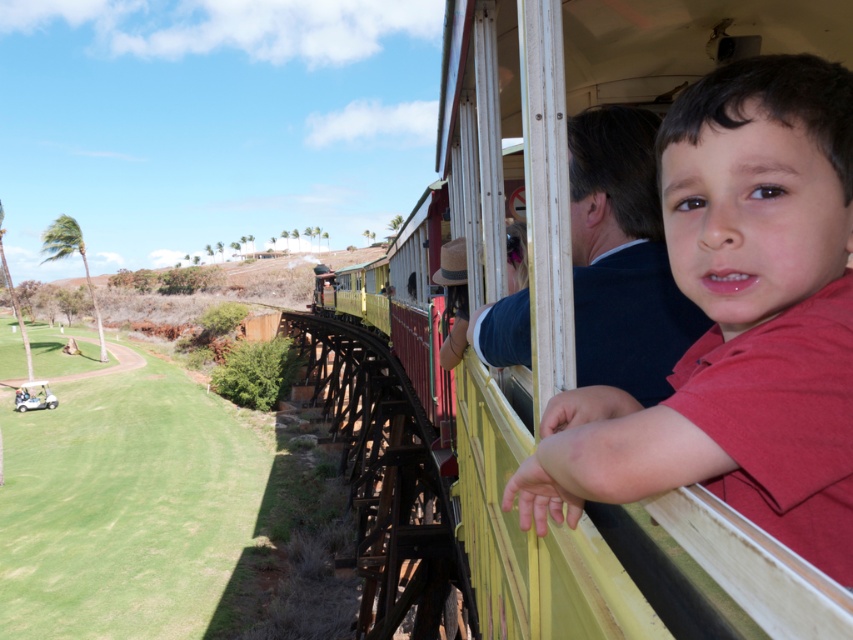
From the picture: You are a photographer trying to capture the scene through the train window. You want to ensure both the matte red shirt at center and the green grass at lower left are clearly visible in your photo. Given their sizes, which object should you focus on first to ensure it is in sharp focus?

The matte red shirt at center is smaller than green grass at lower left. To ensure both are in focus, you should focus on the smaller object first, which is the matte red shirt at center, as smaller objects often require precise focus to capture details clearly.

You are a photographer standing on the wooden trestle bridge next to the train. You see the matte red shirt at center and the green grass at lower left in your camera viewfinder. Which object appears narrower in your view?

The matte red shirt at center appears narrower than the green grass at lower left because it is thinner.

You are a photographer standing on the wooden trestle bridge. You notice the matte red shirt at center and the green grass at lower left in the scene. Which object is closer to you?

The matte red shirt at center is positioned over green grass at lower left, meaning it is closer to you.